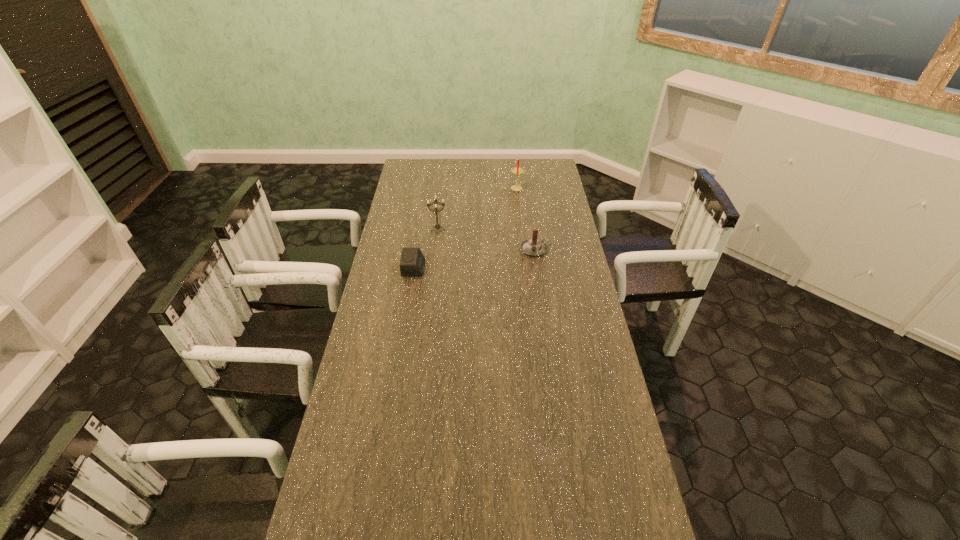
I want to click on free point that satisfies the following two spatial constraints: 1. on the front side of the farther candle; 2. on the front-facing side of the shortest object, so click(x=528, y=268).